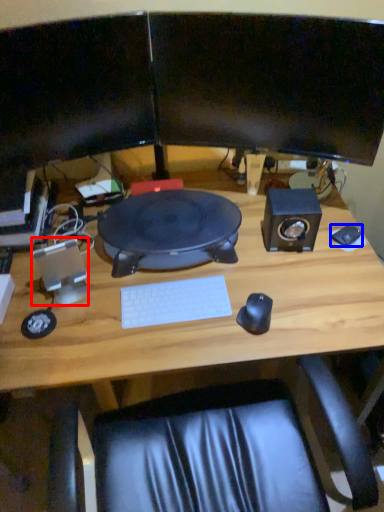
Question: Among these objects, which one is farthest to the camera, speaker (highlighted by a red box) or mouse (highlighted by a blue box)?

Choices:
 (A) speaker
 (B) mouse

Answer: (B)